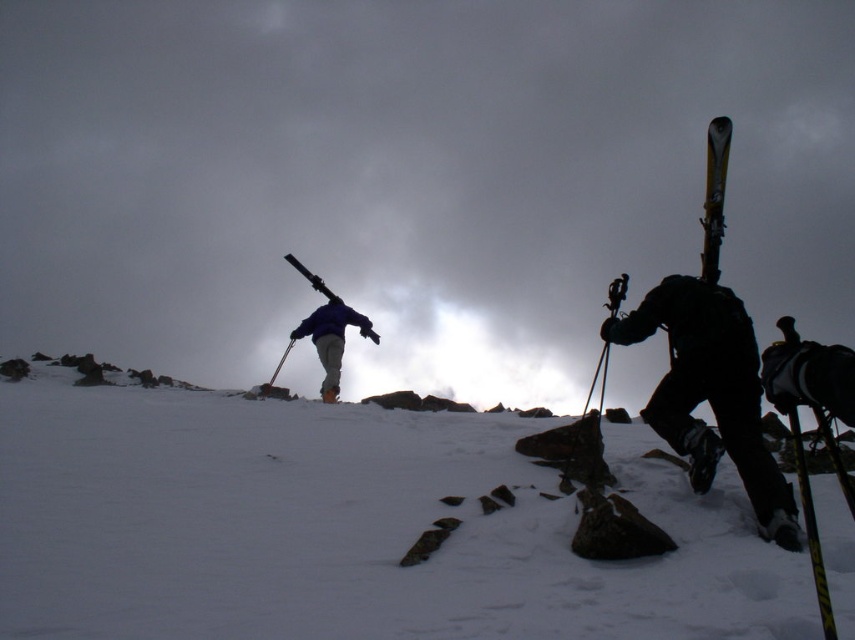
Can you confirm if black matte ski at right is bigger than blue fabric jacket at center?

Incorrect, black matte ski at right is not larger than blue fabric jacket at center.

Does black matte ski at right appear on the right side of blue fabric jacket at center?

Correct, you'll find black matte ski at right to the right of blue fabric jacket at center.

Is point (685, 381) positioned before point (321, 396)?

Yes, point (685, 381) is closer to viewer.

This screenshot has width=855, height=640. What are the coordinates of `black matte ski at right` in the screenshot? It's located at (711, 392).

Does white powdery snow at center have a lesser width compared to glossy metallic ski at upper right?

Yes.

Is point (552, 538) closer to viewer compared to point (726, 147)?

Yes, it is in front of point (726, 147).

Image resolution: width=855 pixels, height=640 pixels. I want to click on white powdery snow at center, so click(x=346, y=528).

You are a GUI agent. You are given a task and a screenshot of the screen. Output one action in this format:
    pyautogui.click(x=<x>, y=<y>)
    Task: Click on the white powdery snow at center
    The width and height of the screenshot is (855, 640).
    Given the screenshot: What is the action you would take?
    346,528

Between point (777, 499) and point (720, 172), which one is positioned behind?

The point (720, 172) is behind.

Can you confirm if black matte ski at right is taller than glossy metallic ski at upper right?

Incorrect, black matte ski at right's height is not larger of glossy metallic ski at upper right's.

Describe the element at coordinates (711, 392) in the screenshot. I see `black matte ski at right` at that location.

You are a GUI agent. You are given a task and a screenshot of the screen. Output one action in this format:
    pyautogui.click(x=<x>, y=<y>)
    Task: Click on the black matte ski at right
    The width and height of the screenshot is (855, 640).
    Given the screenshot: What is the action you would take?
    pyautogui.click(x=711, y=392)